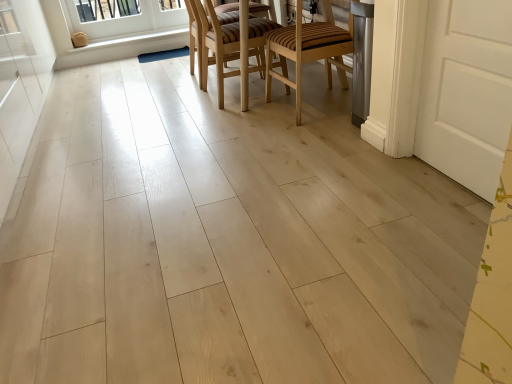
Find the location of a particular element. free region on the left part of wooden chair at center, which is the first chair in left-to-right order is located at coordinates (177, 100).